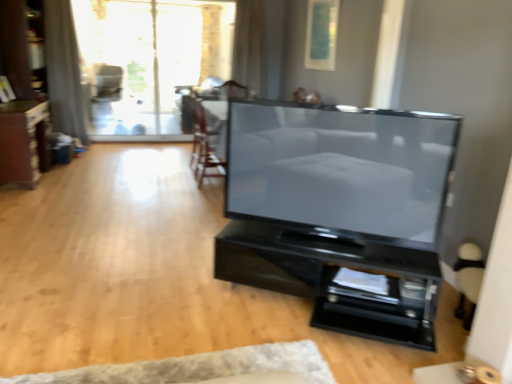
Question: Can you confirm if matte black tv at center is thinner than white textured rug at lower center?

Choices:
 (A) yes
 (B) no

Answer: (A)

Question: From the image's perspective, would you say matte black tv at center is shown under white textured rug at lower center?

Choices:
 (A) yes
 (B) no

Answer: (B)

Question: From a real-world perspective, is matte black tv at center on top of white textured rug at lower center?

Choices:
 (A) no
 (B) yes

Answer: (B)

Question: Considering the relative positions of matte black tv at center and white textured rug at lower center in the image provided, is matte black tv at center to the right of white textured rug at lower center from the viewer's perspective?

Choices:
 (A) no
 (B) yes

Answer: (B)

Question: Is matte black tv at center positioned with its back to white textured rug at lower center?

Choices:
 (A) no
 (B) yes

Answer: (A)

Question: Is white textured rug at lower center inside matte black tv at center?

Choices:
 (A) no
 (B) yes

Answer: (A)

Question: From a real-world perspective, is matte black armchair at upper center, marked as the 2th armchair in a right-to-left arrangement, located beneath transparent glass door at upper center?

Choices:
 (A) yes
 (B) no

Answer: (A)

Question: Can you confirm if matte black armchair at upper center, the 1th armchair in the back-to-front sequence, is bigger than transparent glass door at upper center?

Choices:
 (A) no
 (B) yes

Answer: (A)

Question: Can you confirm if matte black armchair at upper center, positioned as the second armchair in bottom-to-top order, is taller than transparent glass door at upper center?

Choices:
 (A) no
 (B) yes

Answer: (A)

Question: Is matte black armchair at upper center, the first armchair when ordered from top to bottom, aimed at transparent glass door at upper center?

Choices:
 (A) yes
 (B) no

Answer: (B)

Question: Is the depth of matte black armchair at upper center, positioned as the second armchair in bottom-to-top order, greater than that of transparent glass door at upper center?

Choices:
 (A) no
 (B) yes

Answer: (B)

Question: Is transparent glass door at upper center a part of matte black armchair at upper center, positioned as the second armchair in bottom-to-top order?

Choices:
 (A) no
 (B) yes

Answer: (A)

Question: Could you tell me if black glossy tv stand at center, the 2th furniture viewed from the back, is turned towards white textured rug at lower center?

Choices:
 (A) yes
 (B) no

Answer: (A)